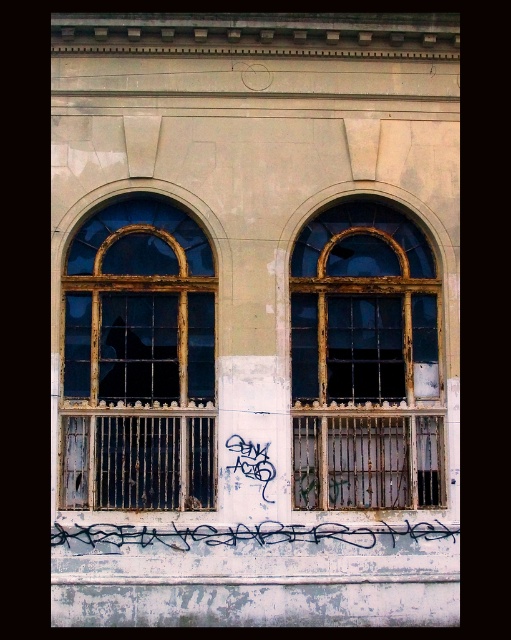
You are a painter who needs to measure the space between two rusty metal windows on a wall. You have a 1.5 meter ladder. Can you safely reach the gap between the rusty metal window at left and the rusty metal window at center?

The distance between the rusty metal window at left and the rusty metal window at center is 1.63 meters. Since your ladder is only 1.5 meters long, it is not long enough to safely bridge the gap between them.

Consider the image. You are standing in front of an old building with two arched windows. You notice a specific point at coordinates [138,360]. Which object from the scene is exactly at that point?

Answer: The rusty metal window at left is located at point [138,360].

Consider the image. You are standing in front of the building with two arched windows. There are two points marked on the wall. The first point is at coordinate point (369,253) and the second is at point (141,541). Which point is closer to you?

Point (141,541) is closer to you because it is in front of point (369,253).